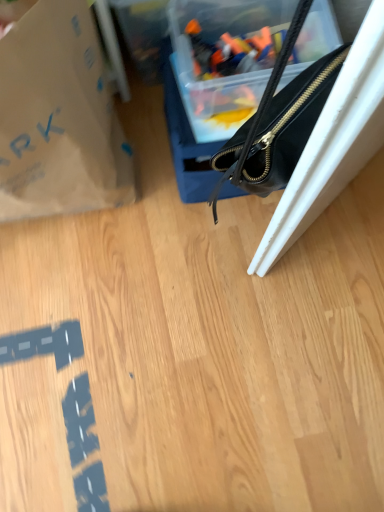
Question: Should I look upward or downward to see brown paper bag at upper left?

Choices:
 (A) up
 (B) down

Answer: (A)

Question: Could you tell me if brown paper bag at upper left is facing black leather handbag at upper right?

Choices:
 (A) no
 (B) yes

Answer: (A)

Question: Is brown paper bag at upper left placed right next to black leather handbag at upper right?

Choices:
 (A) no
 (B) yes

Answer: (A)

Question: From a real-world perspective, is brown paper bag at upper left located higher than black leather handbag at upper right?

Choices:
 (A) yes
 (B) no

Answer: (A)

Question: Is brown paper bag at upper left shorter than black leather handbag at upper right?

Choices:
 (A) no
 (B) yes

Answer: (A)

Question: From the image's perspective, would you say brown paper bag at upper left is positioned over black leather handbag at upper right?

Choices:
 (A) yes
 (B) no

Answer: (B)

Question: Does brown paper bag at upper left have a greater width compared to black leather handbag at upper right?

Choices:
 (A) yes
 (B) no

Answer: (B)

Question: Is black leather handbag at upper right not near brown paper bag at upper left?

Choices:
 (A) no
 (B) yes

Answer: (A)

Question: Does black leather handbag at upper right contain brown paper bag at upper left?

Choices:
 (A) yes
 (B) no

Answer: (B)

Question: From a real-world perspective, is black leather handbag at upper right under brown paper bag at upper left?

Choices:
 (A) no
 (B) yes

Answer: (B)

Question: Does black leather handbag at upper right have a larger size compared to brown paper bag at upper left?

Choices:
 (A) no
 (B) yes

Answer: (A)

Question: Can you confirm if black leather handbag at upper right is positioned to the left of brown paper bag at upper left?

Choices:
 (A) yes
 (B) no

Answer: (B)

Question: Is black leather handbag at upper right looking in the opposite direction of brown paper bag at upper left?

Choices:
 (A) no
 (B) yes

Answer: (A)

Question: From their relative heights in the image, would you say black leather handbag at upper right is taller or shorter than brown paper bag at upper left?

Choices:
 (A) short
 (B) tall

Answer: (A)